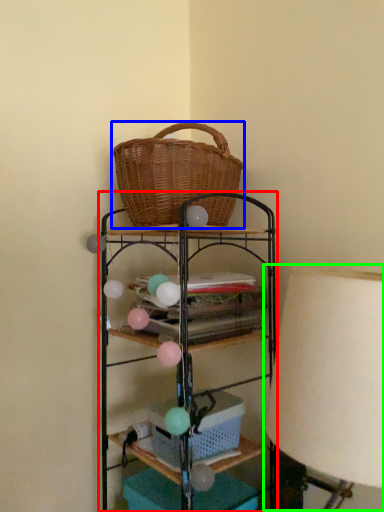
Question: Considering the real-world distances, which object is closest to shelf (highlighted by a red box)? picnic basket (highlighted by a blue box) or table lamp (highlighted by a green box).

Choices:
 (A) picnic basket
 (B) table lamp

Answer: (A)